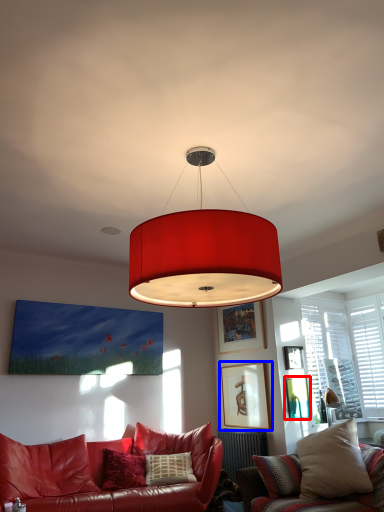
Question: Among these objects, which one is nearest to the camera, picture frame (highlighted by a red box) or picture frame (highlighted by a blue box)?

Choices:
 (A) picture frame
 (B) picture frame

Answer: (A)